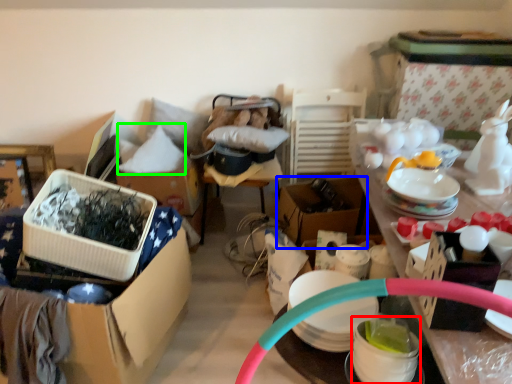
Question: Estimate the real-world distances between objects in this image. Which object is closer to bowl (highlighted by a red box), box (highlighted by a blue box) or pillow (highlighted by a green box)?

Choices:
 (A) box
 (B) pillow

Answer: (A)